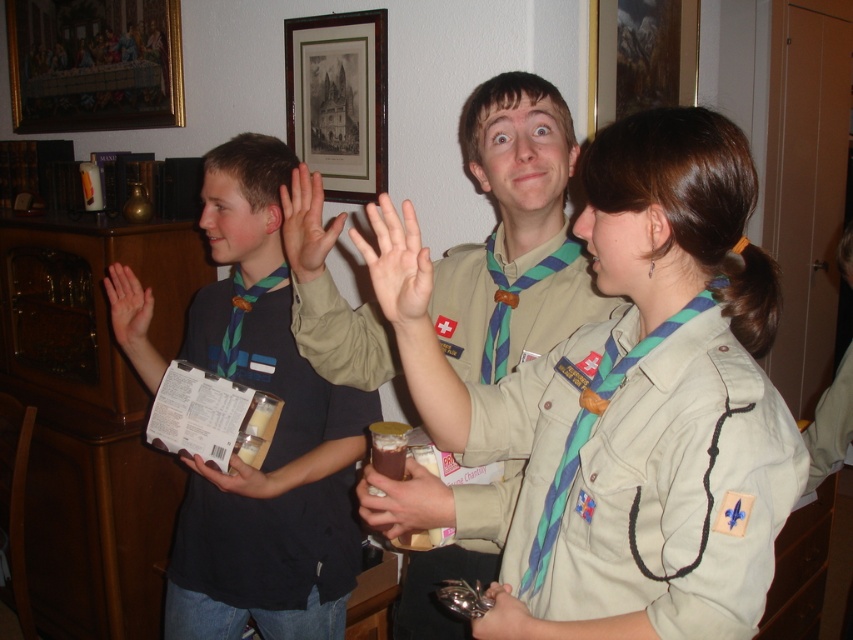
You are a guest at a gathering and see the khaki fabric uniform at center and the matte plastic cup at center. Which object is taller?

The khaki fabric uniform at center is taller than the matte plastic cup at center.

You are a scout leader observing the group and need to ensure proper spacing between the two hands at the center. According to the scout manual, hands should be at least 6 inches apart during the salute. Are the matte beige hand at center and the matte brown hand at center meeting this requirement?

The matte beige hand at center is 6.20 inches away from the matte brown hand at center, which meets the requirement of at least 6 inches apart as per the scout manual.

You are a scout leader observing the scene. You need to determine where the beige uniform at center is in relation to the smooth plastic cup at center. Which object is higher?

A: The beige uniform at center is located above the smooth plastic cup at center, so the beige uniform at center is higher.